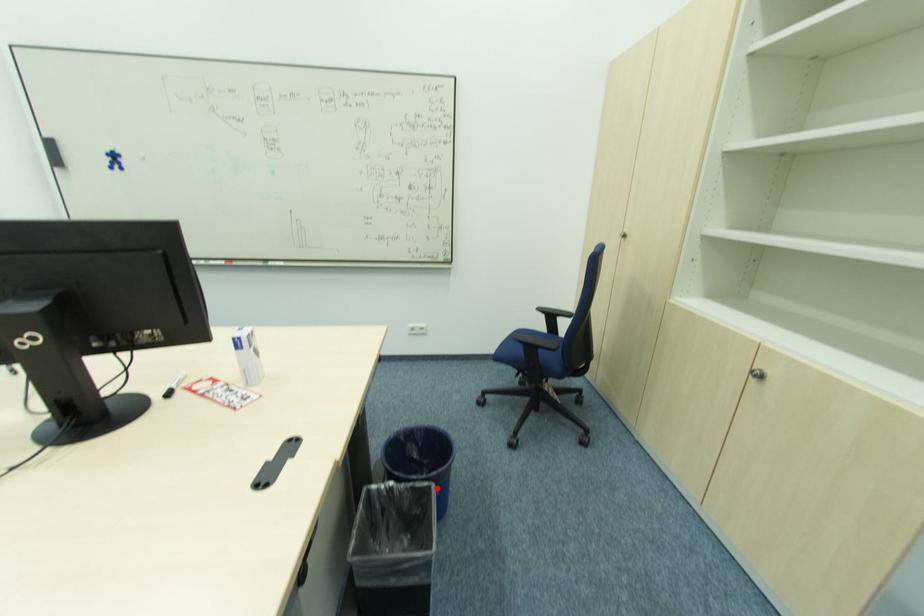
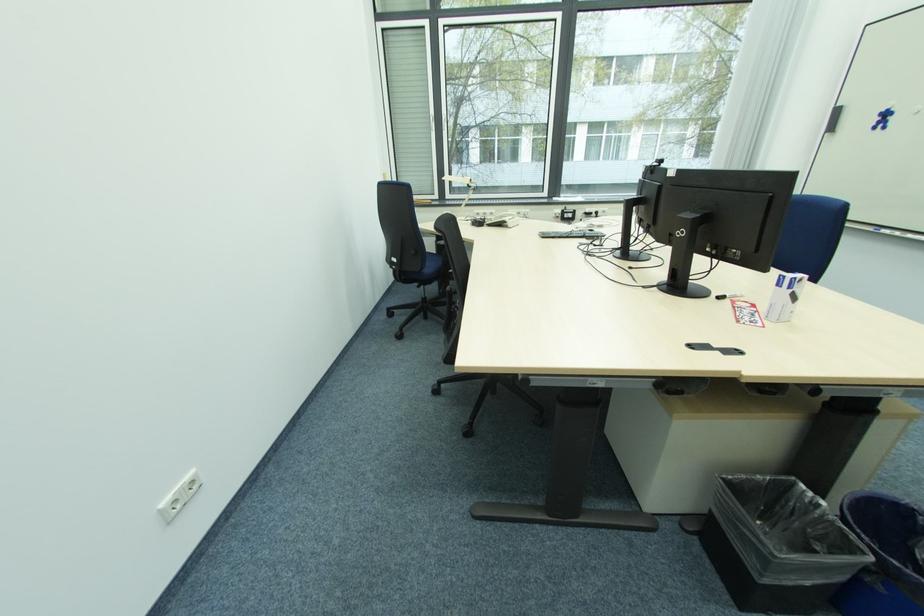
Where in the second image is the point corresponding to the highlighted location from the first image?

(874, 562)